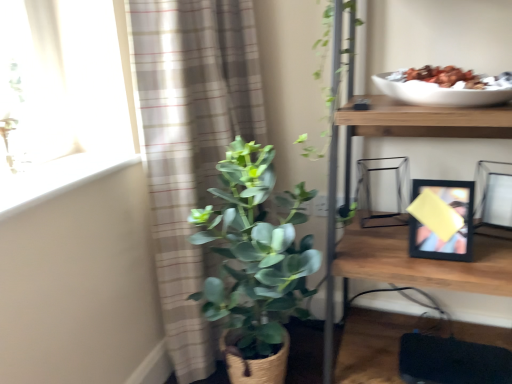
Describe the element at coordinates (405, 261) in the screenshot. I see `wooden shelf at upper right` at that location.

You are a GUI agent. You are given a task and a screenshot of the screen. Output one action in this format:
    pyautogui.click(x=<x>, y=<y>)
    Task: Click on the black matte picture frame at right, which is the 1th picture frame from left to right
    This screenshot has height=384, width=512.
    Given the screenshot: What is the action you would take?
    pyautogui.click(x=434, y=233)

At what (x,y) coordinates should I click in order to perform the action: click on green matte plant at center. Please return your answer as a coordinate pair (x, y). Image resolution: width=512 pixels, height=384 pixels. Looking at the image, I should click on (254, 253).

How far apart are black matte picture frame at right, which is the 1th picture frame from left to right, and wooden shelf at upper right?

black matte picture frame at right, which is the 1th picture frame from left to right, and wooden shelf at upper right are 5.38 inches apart.

Is point (417, 182) farther from viewer compared to point (502, 132)?

Yes, it is behind point (502, 132).

Looking at this image, could you tell me if black matte picture frame at right, which is the 1th picture frame from left to right, is turned towards wooden shelf at upper right?

Yes.

Is green matte plant at center directly adjacent to matte black picture frame at right, marked as the 1th picture frame in a right-to-left arrangement?

green matte plant at center and matte black picture frame at right, marked as the 1th picture frame in a right-to-left arrangement, are not in contact.

Considering the relative sizes of green matte plant at center and matte black picture frame at right, placed as the 2th picture frame when sorted from left to right, in the image provided, is green matte plant at center thinner than matte black picture frame at right, placed as the 2th picture frame when sorted from left to right,?

In fact, green matte plant at center might be wider than matte black picture frame at right, placed as the 2th picture frame when sorted from left to right.

From a real-world perspective, is green matte plant at center on top of matte black picture frame at right, marked as the 1th picture frame in a right-to-left arrangement?

No, from a real-world perspective, green matte plant at center is not on top of matte black picture frame at right, marked as the 1th picture frame in a right-to-left arrangement.

Can we say green matte plant at center lies outside matte black picture frame at right, placed as the 2th picture frame when sorted from left to right?

Yes, green matte plant at center is outside of matte black picture frame at right, placed as the 2th picture frame when sorted from left to right.

The image size is (512, 384). In order to click on picture frame that appears above the wooden shelf at upper right (from the image's perspective) in this screenshot , I will do coord(493,199).

Which is in front, point (493, 229) or point (444, 133)?

Positioned in front is point (444, 133).

From a real-world perspective, between matte black picture frame at right, placed as the 2th picture frame when sorted from left to right, and wooden shelf at upper right, who is vertically lower?

In real-world perspective, wooden shelf at upper right is lower.

Considering the sizes of objects matte black picture frame at right, placed as the 2th picture frame when sorted from left to right, and wooden shelf at upper right in the image provided, who is wider, matte black picture frame at right, placed as the 2th picture frame when sorted from left to right, or wooden shelf at upper right?

wooden shelf at upper right is wider.

Considering the positions of objects wooden shelf at upper right and plaid fabric curtain at left in the image provided, who is more to the right, wooden shelf at upper right or plaid fabric curtain at left?

wooden shelf at upper right is more to the right.

Is wooden shelf at upper right surrounding plaid fabric curtain at left?

No, plaid fabric curtain at left is located outside of wooden shelf at upper right.

Is the depth of green matte plant at center less than that of plaid fabric curtain at left?

Yes, it is.

Which object is wider, green matte plant at center or plaid fabric curtain at left?

green matte plant at center.

Looking at this image, from their relative heights in the image, would you say green matte plant at center is taller or shorter than plaid fabric curtain at left?

In the image, green matte plant at center appears to be shorter than plaid fabric curtain at left.

From the image's perspective, relative to plaid fabric curtain at left, is green matte plant at center above or below?

green matte plant at center is below plaid fabric curtain at left.

Between matte black picture frame at right, placed as the 2th picture frame when sorted from left to right, and black matte picture frame at right, which is the 1th picture frame from left to right, which one has more height?

Standing taller between the two is black matte picture frame at right, which is the 1th picture frame from left to right.

Are matte black picture frame at right, placed as the 2th picture frame when sorted from left to right, and black matte picture frame at right, which is the 1th picture frame from left to right, far apart?

No.

Is black matte picture frame at right, which is the second picture frame from right to left, a part of matte black picture frame at right, marked as the 1th picture frame in a right-to-left arrangement?

No.

Is there a large distance between white smooth window sill at upper left and black matte picture frame at right, which is the second picture frame from right to left?

No, white smooth window sill at upper left is not far from black matte picture frame at right, which is the second picture frame from right to left.

From a real-world perspective, relative to black matte picture frame at right, which is the second picture frame from right to left, is white smooth window sill at upper left vertically above or below?

white smooth window sill at upper left is situated higher than black matte picture frame at right, which is the second picture frame from right to left, in the real world.

Where is `picture frame located on the left of wooden shelf at upper right`? The image size is (512, 384). picture frame located on the left of wooden shelf at upper right is located at coordinates (434, 233).

Locate an element on the screen. picture frame that is the 2nd object to the right of the green matte plant at center, starting at the anchor is located at coordinates (493, 199).

Based on their spatial positions, is wooden shelf at upper right or matte black picture frame at right, marked as the 1th picture frame in a right-to-left arrangement, further from green matte plant at center?

matte black picture frame at right, marked as the 1th picture frame in a right-to-left arrangement.

In the scene shown: Considering their positions, is matte black picture frame at right, placed as the 2th picture frame when sorted from left to right, positioned closer to black matte picture frame at right, which is the 1th picture frame from left to right, than white smooth window sill at upper left?

matte black picture frame at right, placed as the 2th picture frame when sorted from left to right, is closer to black matte picture frame at right, which is the 1th picture frame from left to right.

Estimate the real-world distances between objects in this image. Which object is closer to wooden shelf at upper right, plaid fabric curtain at left or black matte picture frame at right, which is the second picture frame from right to left?

black matte picture frame at right, which is the second picture frame from right to left, is closer to wooden shelf at upper right.

From the image, which object appears to be farther from green matte plant at center, plaid fabric curtain at left or white smooth window sill at upper left?

white smooth window sill at upper left lies further to green matte plant at center than the other object.

Estimate the real-world distances between objects in this image. Which object is further from white smooth window sill at upper left, matte black picture frame at right, placed as the 2th picture frame when sorted from left to right, or black matte picture frame at right, which is the 1th picture frame from left to right?

Among the two, matte black picture frame at right, placed as the 2th picture frame when sorted from left to right, is located further to white smooth window sill at upper left.

Which object lies further to the anchor point white smooth window sill at upper left, wooden shelf at upper right or green matte plant at center?

Among the two, wooden shelf at upper right is located further to white smooth window sill at upper left.

Considering their positions, is black matte picture frame at right, which is the 1th picture frame from left to right, positioned closer to wooden shelf at upper right than matte black picture frame at right, marked as the 1th picture frame in a right-to-left arrangement?

black matte picture frame at right, which is the 1th picture frame from left to right, is closer to wooden shelf at upper right.

Based on their spatial positions, is plaid fabric curtain at left or green matte plant at center further from black matte picture frame at right, which is the second picture frame from right to left?

The object further to black matte picture frame at right, which is the second picture frame from right to left, is plaid fabric curtain at left.

You are a GUI agent. You are given a task and a screenshot of the screen. Output one action in this format:
    pyautogui.click(x=<x>, y=<y>)
    Task: Click on the houseplant between white smooth window sill at upper left and wooden shelf at upper right in the horizontal direction
    
    Given the screenshot: What is the action you would take?
    pyautogui.click(x=254, y=253)

Identify the location of picture frame between white smooth window sill at upper left and matte black picture frame at right, placed as the 2th picture frame when sorted from left to right, from left to right. This screenshot has width=512, height=384. (434, 233).

Locate an element on the screen. The image size is (512, 384). shelf between plaid fabric curtain at left and matte black picture frame at right, marked as the 1th picture frame in a right-to-left arrangement, in the horizontal direction is located at coordinates (405, 261).

This screenshot has height=384, width=512. I want to click on houseplant between plaid fabric curtain at left and black matte picture frame at right, which is the second picture frame from right to left, in the horizontal direction, so click(x=254, y=253).